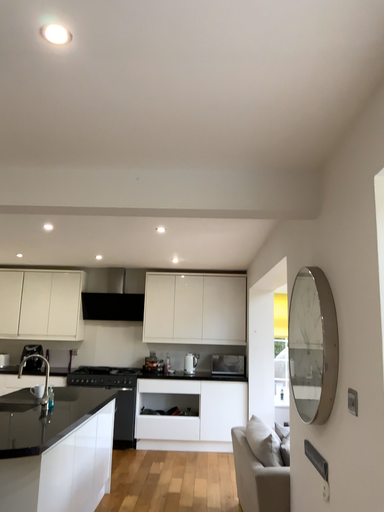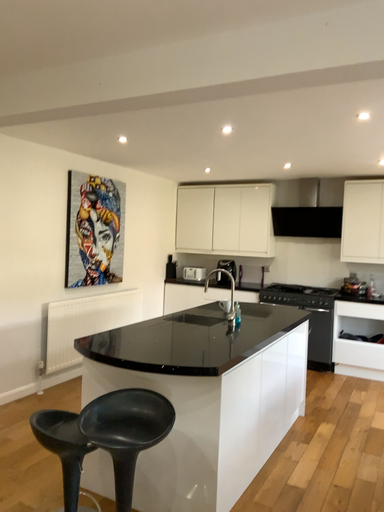
Question: How did the camera likely rotate when shooting the video?

Choices:
 (A) rotated downward
 (B) rotated upward

Answer: (A)